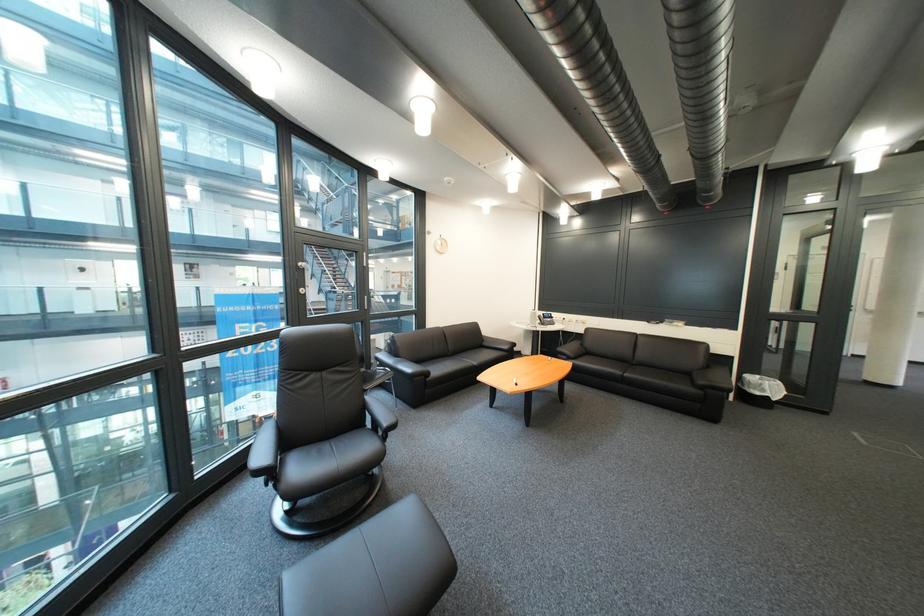
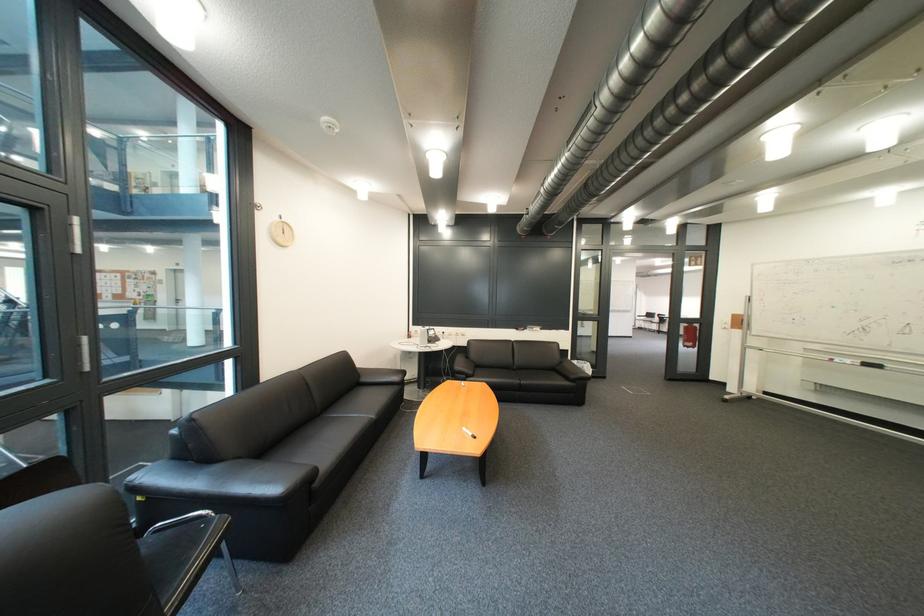
Where in the second image is the point corresponding to pixel 553 310 from the first image?

(428, 326)